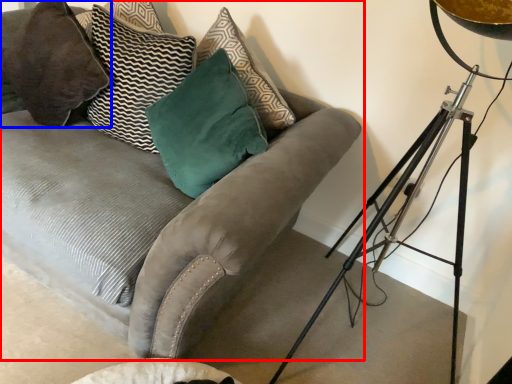
Question: Which object appears closest to the camera in this image, studio couch (highlighted by a red box) or pillow (highlighted by a blue box)?

Choices:
 (A) studio couch
 (B) pillow

Answer: (A)